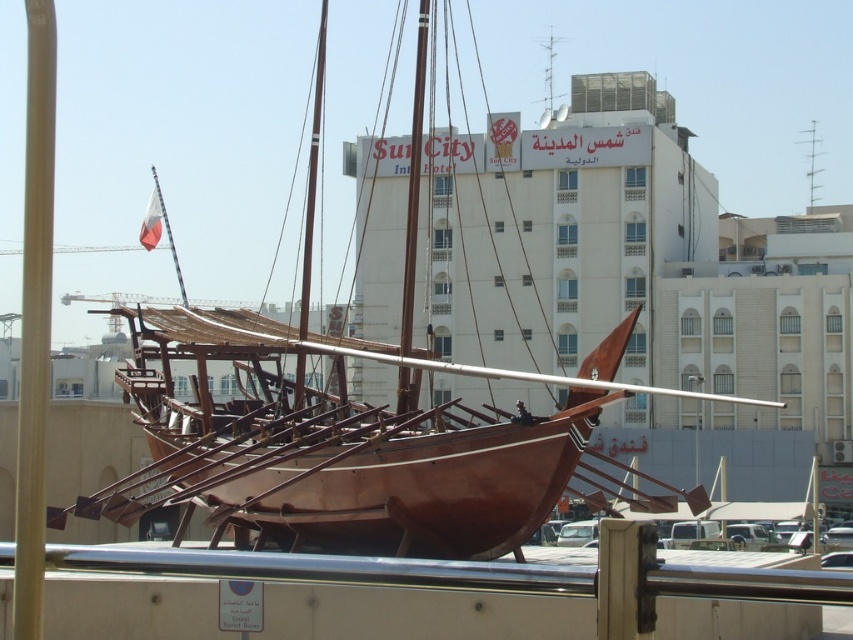
Who is more forward, (303, 365) or (811, 205)?

Point (303, 365) is in front.

Does point (309, 266) come behind point (811, 129)?

No.

Image resolution: width=853 pixels, height=640 pixels. What are the coordinates of `brown wooden mast at center` in the screenshot? It's located at (312, 173).

Image resolution: width=853 pixels, height=640 pixels. Find the location of `brown wooden mast at center`. brown wooden mast at center is located at coordinates (312, 173).

Which is below, wooden mast at center or brown wooden mast at center?

wooden mast at center is below.

Is the position of wooden mast at center more distant than that of brown wooden mast at center?

No, it is not.

Between point (408, 232) and point (321, 96), which one is positioned behind?

The point (321, 96) is more distant.

Find the location of `wooden mast at center`. wooden mast at center is located at coordinates (413, 180).

Can you confirm if wooden mast at left is thinner than brown wooden mast at center?

Yes, wooden mast at left is thinner than brown wooden mast at center.

Is wooden mast at left smaller than brown wooden mast at center?

Yes.

Who is more distant from viewer, (53, 157) or (306, 193)?

The point (306, 193) is behind.

The width and height of the screenshot is (853, 640). What are the coordinates of `wooden mast at left` in the screenshot? It's located at (33, 317).